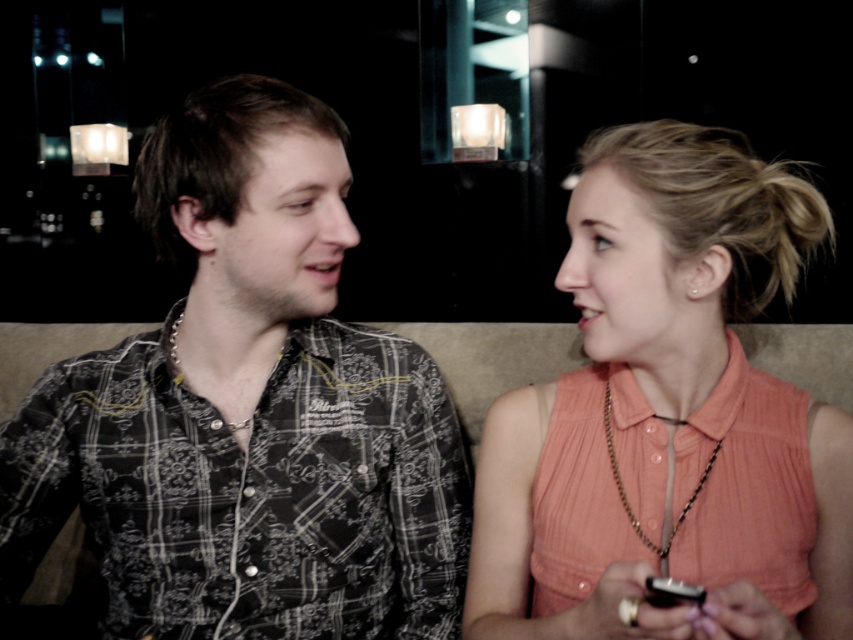
Question: Which object is farther from the camera taking this photo?

Choices:
 (A) gold chain necklace at upper right
 (B) black plastic phone at lower right
 (C) matte peach blouse at right

Answer: (A)

Question: Can you confirm if gold chain necklace at upper right is smaller than black plastic phone at lower right?

Choices:
 (A) no
 (B) yes

Answer: (A)

Question: Is matte peach blouse at right positioned before gold chain necklace at upper right?

Choices:
 (A) no
 (B) yes

Answer: (B)

Question: Is patterned fabric shirt at left smaller than black plastic phone at lower right?

Choices:
 (A) yes
 (B) no

Answer: (B)

Question: Which object is farther from the camera taking this photo?

Choices:
 (A) gold chain necklace at upper right
 (B) matte peach blouse at right
 (C) black plastic phone at lower right
 (D) patterned fabric shirt at left

Answer: (D)

Question: Which point is closer to the camera taking this photo?

Choices:
 (A) (705, 467)
 (B) (685, 593)
 (C) (375, 429)

Answer: (B)